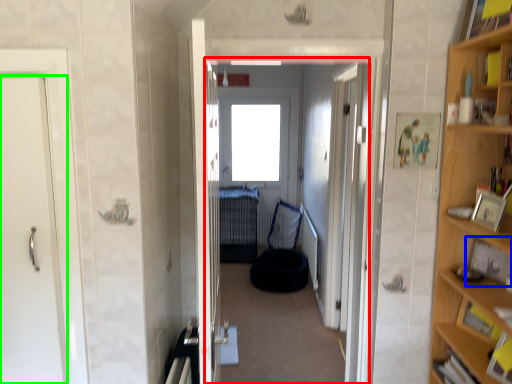
Question: Which object is positioned closest to corridor (highlighted by a red box)? Select from picture frame (highlighted by a blue box) and door (highlighted by a green box).

Choices:
 (A) picture frame
 (B) door

Answer: (A)